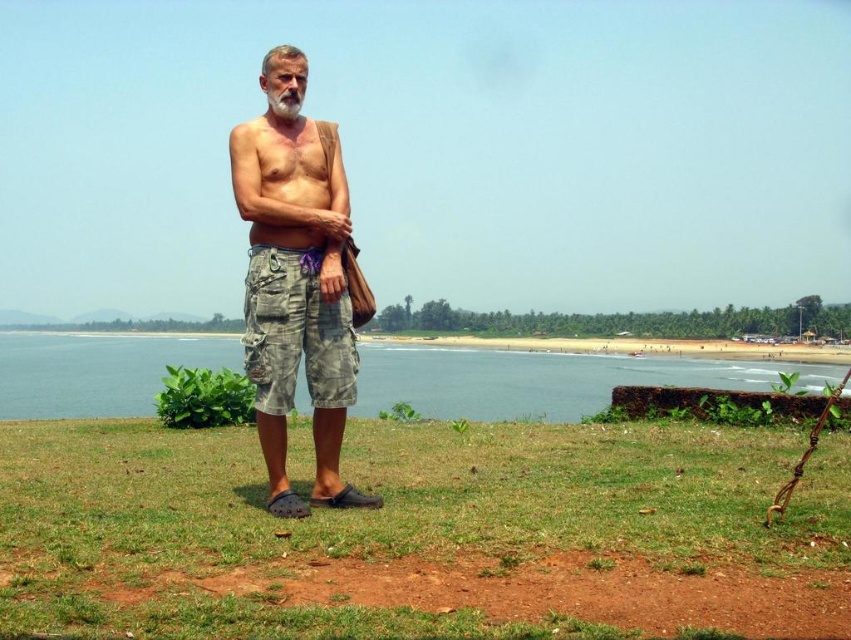
You are a photographer trying to capture a landscape shot. You have to decide whether to focus on the green grass at center or the blue water at lower left. Which area is shorter in height?

The green grass at center is not as tall as the blue water at lower left, so the green grass at center is shorter in height.